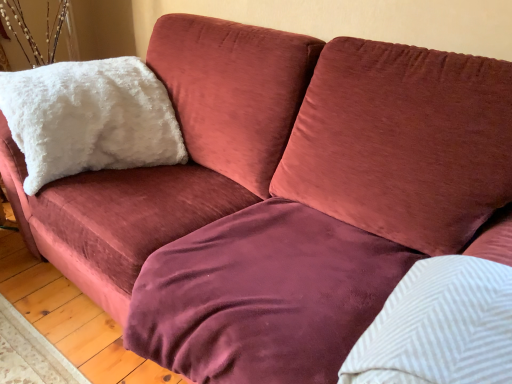
Question: From a real-world perspective, is white fluffy pillow at upper left, the 2th pillow from the right, over velvet maroon blanket at center?

Choices:
 (A) yes
 (B) no

Answer: (A)

Question: Can you confirm if white fluffy pillow at upper left, positioned as the second pillow in bottom-to-top order, is bigger than velvet maroon blanket at center?

Choices:
 (A) yes
 (B) no

Answer: (A)

Question: Is white fluffy pillow at upper left, positioned as the second pillow in bottom-to-top order, oriented towards velvet maroon blanket at center?

Choices:
 (A) no
 (B) yes

Answer: (B)

Question: Is white fluffy pillow at upper left, which is counted as the second pillow, starting from the front, oriented away from velvet maroon blanket at center?

Choices:
 (A) no
 (B) yes

Answer: (A)

Question: From the image's perspective, is white fluffy pillow at upper left, which is the first pillow in top-to-bottom order, over velvet maroon blanket at center?

Choices:
 (A) yes
 (B) no

Answer: (A)

Question: Is white fluffy pillow at upper left, which appears as the 1th pillow when viewed from the back, wider than velvet maroon blanket at center?

Choices:
 (A) no
 (B) yes

Answer: (A)

Question: Is velvet maroon blanket at center at the left side of white fluffy pillow at upper left, which appears as the 1th pillow when viewed from the back?

Choices:
 (A) no
 (B) yes

Answer: (A)

Question: Is the depth of velvet maroon blanket at center greater than that of white fluffy pillow at upper left, positioned as the second pillow in bottom-to-top order?

Choices:
 (A) yes
 (B) no

Answer: (B)

Question: Considering the relative positions of velvet maroon blanket at center and white fluffy pillow at upper left, which is counted as the second pillow, starting from the front, in the image provided, is velvet maroon blanket at center to the right of white fluffy pillow at upper left, which is counted as the second pillow, starting from the front, from the viewer's perspective?

Choices:
 (A) no
 (B) yes

Answer: (B)

Question: Does velvet maroon blanket at center have a larger size compared to white fluffy pillow at upper left, which is counted as the second pillow, starting from the front?

Choices:
 (A) no
 (B) yes

Answer: (A)

Question: From a real-world perspective, is velvet maroon blanket at center physically above white fluffy pillow at upper left, arranged as the 1th pillow when viewed from the left?

Choices:
 (A) yes
 (B) no

Answer: (B)

Question: From a real-world perspective, is velvet maroon blanket at center beneath white fluffy pillow at upper left, arranged as the 1th pillow when viewed from the left?

Choices:
 (A) no
 (B) yes

Answer: (B)

Question: Considering the relative positions of white fluffy pillow at upper left, arranged as the 1th pillow when viewed from the left, and white textured pillow at upper right, positioned as the first pillow in right-to-left order, in the image provided, is white fluffy pillow at upper left, arranged as the 1th pillow when viewed from the left, to the left of white textured pillow at upper right, positioned as the first pillow in right-to-left order, from the viewer's perspective?

Choices:
 (A) yes
 (B) no

Answer: (A)